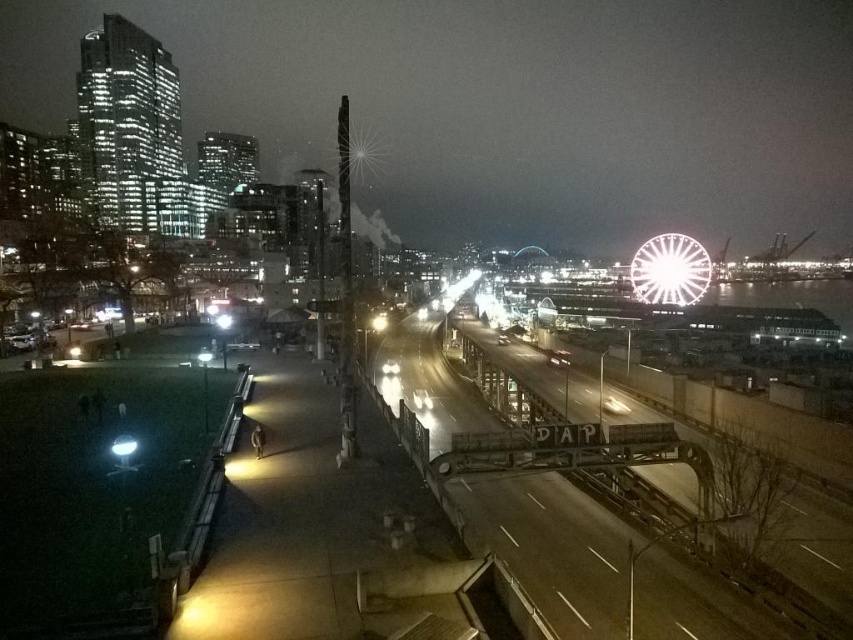
Does metallic gray train track at center have a lesser height compared to white metallic ferris wheel at right?

Correct, metallic gray train track at center is not as tall as white metallic ferris wheel at right.

Is metallic gray train track at center positioned at the back of white metallic ferris wheel at right?

No, metallic gray train track at center is closer to the viewer.

Between point (798, 637) and point (677, 264), which one is positioned in front?

Point (798, 637) is more forward.

The height and width of the screenshot is (640, 853). Identify the location of metallic gray train track at center. (554, 547).